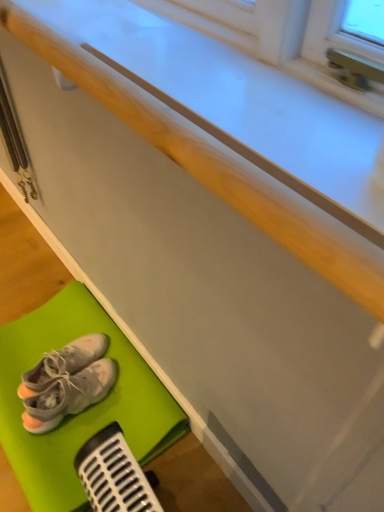
Where is `vacant area on the back side of white fabric sneakers at lower left, placed as the 2th footwear when sorted from bottom to top`? The width and height of the screenshot is (384, 512). vacant area on the back side of white fabric sneakers at lower left, placed as the 2th footwear when sorted from bottom to top is located at coordinates (70, 320).